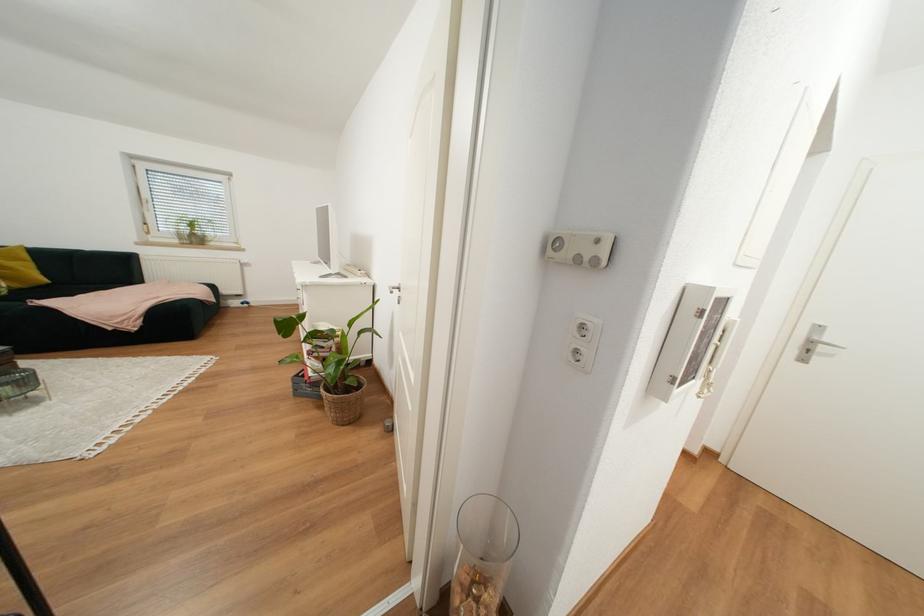
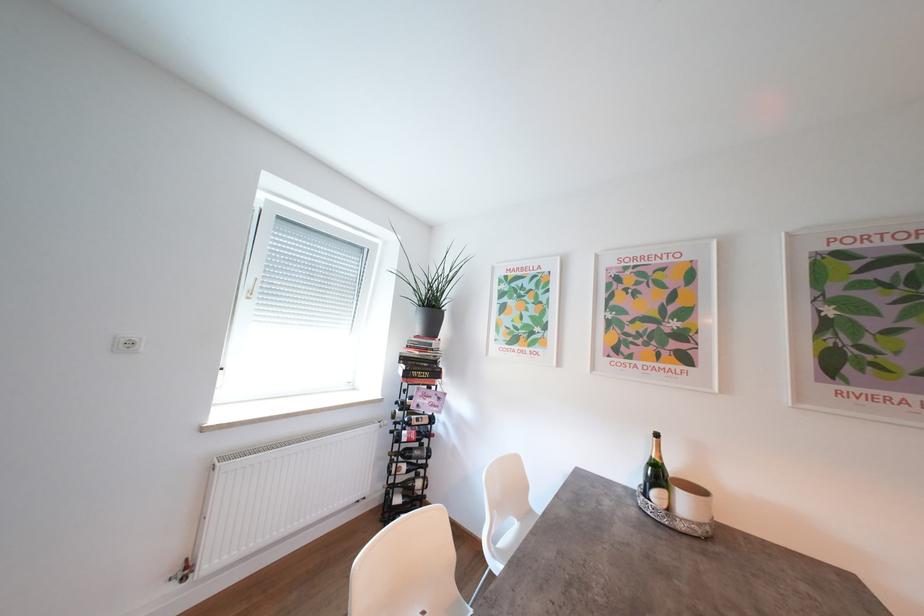
Question: Which direction would the cameraman need to move to produce the second image? Reply with the corresponding letter.

Choices:
 (A) Left
 (B) Right
 (C) Forward
 (D) Backward

Answer: (C)